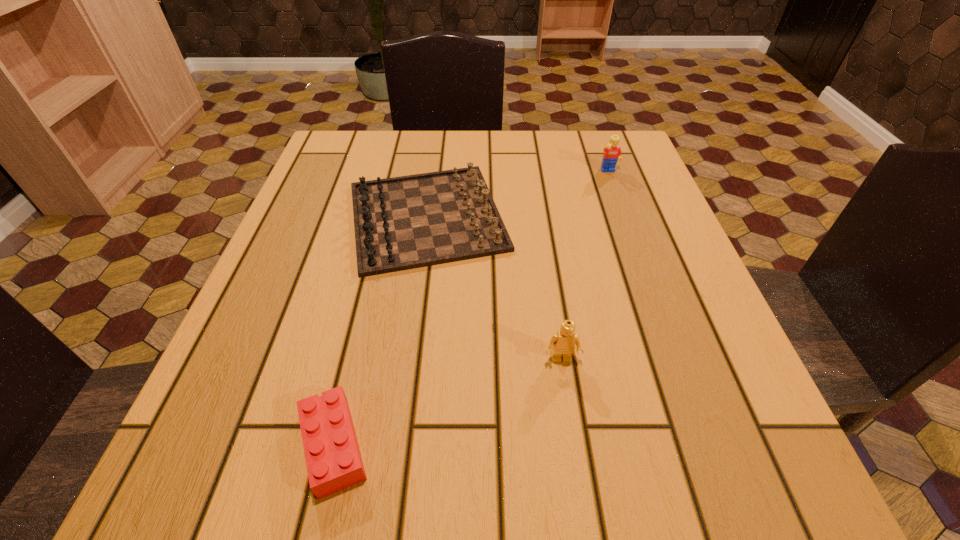
At what (x,y) coordinates should I click in order to perform the action: click on free location at the far edge of the desktop. Please return your answer as a coordinate pair (x, y). Looking at the image, I should click on (554, 160).

The height and width of the screenshot is (540, 960). In order to click on vacant space at the near edge of the desktop in this screenshot , I will do `click(613, 487)`.

Find the location of a particular element. vacant space at the left edge is located at coordinates (291, 357).

The height and width of the screenshot is (540, 960). Identify the location of vacant space at the right edge of the desktop. (665, 285).

Locate an element on the screen. free space at the far left corner of the desktop is located at coordinates (339, 139).

What are the coordinates of `vacant point at the far right corner` in the screenshot? It's located at (632, 163).

Find the location of `vacant space in between the leftmost Lego and the third tallest object`. vacant space in between the leftmost Lego and the third tallest object is located at coordinates [x=380, y=331].

Find the location of a particular element. The width and height of the screenshot is (960, 540). free space between the third tallest object and the second nearest object is located at coordinates (494, 288).

At what (x,y) coordinates should I click in order to perform the action: click on vacant point located between the second Lego from left to right and the chessboard. Please return your answer as a coordinate pair (x, y). Looking at the image, I should click on (494, 288).

Locate an element on the screen. This screenshot has width=960, height=540. vacant space in between the second Lego from left to right and the rightmost object is located at coordinates (586, 266).